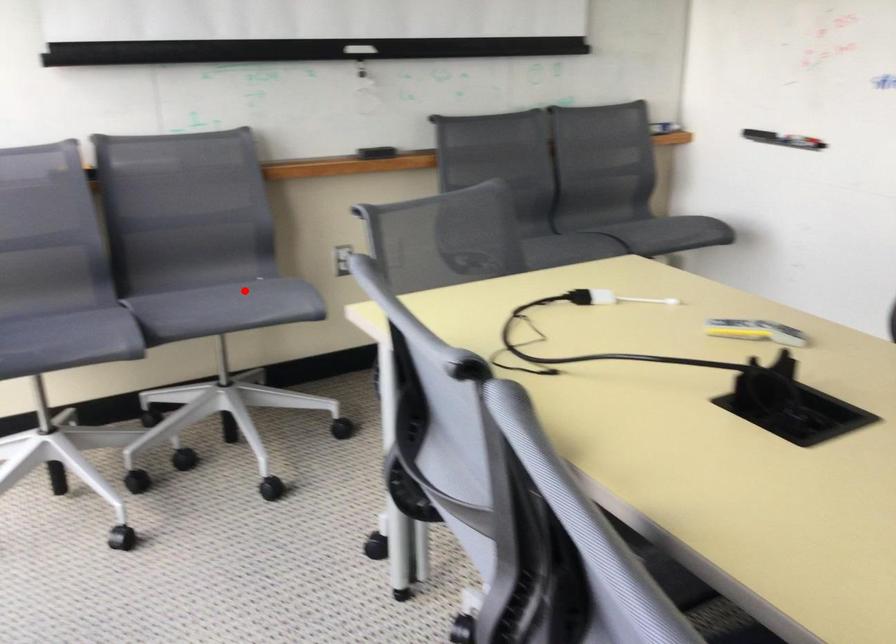
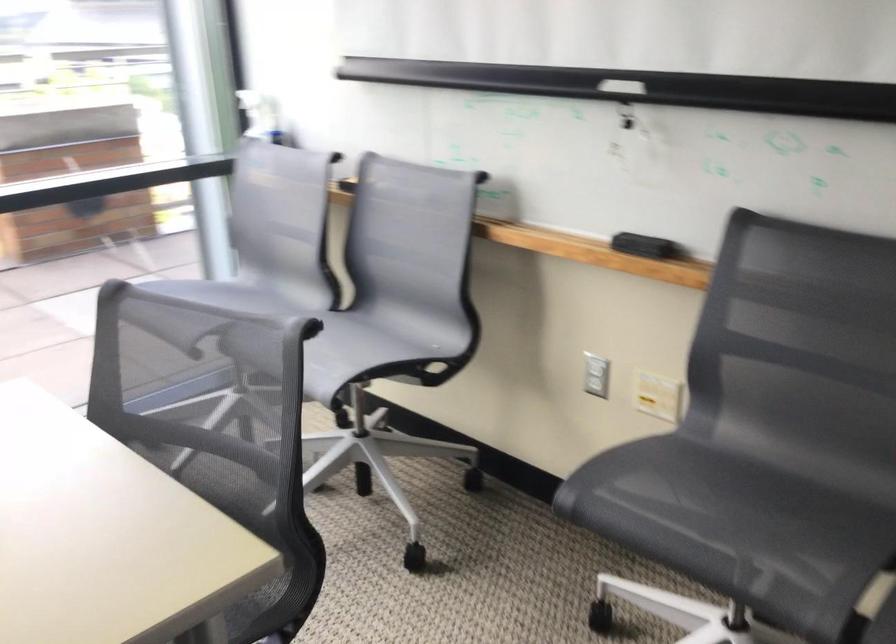
Question: I am providing you with two images of the same scene from different viewpoints. Image1 has a red point marked. In image2, the corresponding 3D location appears at what relative position? Reply with the corresponding letter.

Choices:
 (A) Closer
 (B) Farther

Answer: (A)